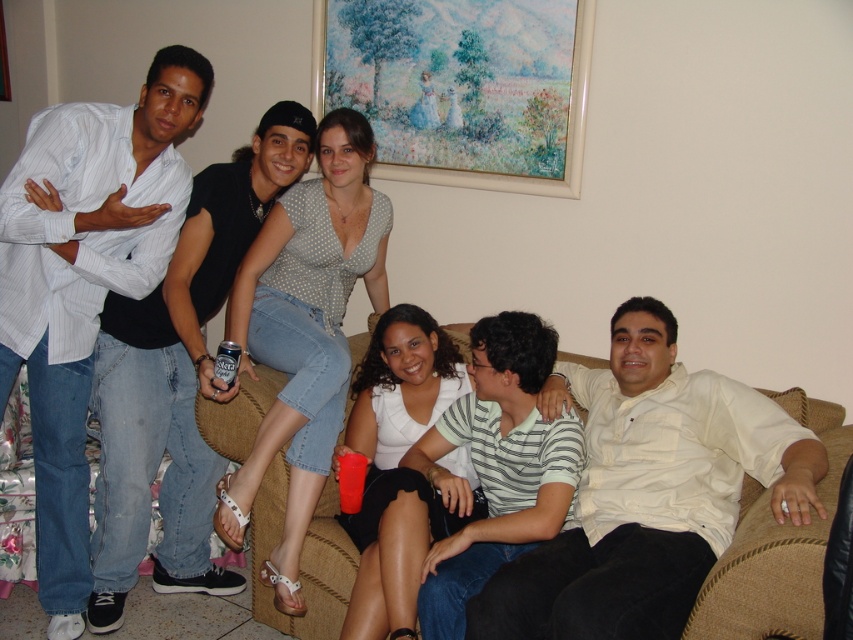
Question: Can you confirm if pastel oil painting at upper center is positioned to the right of polka dot blouse at upper center?

Choices:
 (A) no
 (B) yes

Answer: (B)

Question: Which of the following is the closest to the observer?

Choices:
 (A) white satin shirt at center
 (B) white striped shirt at left

Answer: (A)

Question: Which of these objects is positioned closest to the white satin shirt at center?

Choices:
 (A) white striped shirt at left
 (B) striped cotton polo shirt at center
 (C) pastel oil painting at upper center
 (D) white matte dress at center

Answer: (B)

Question: Does pastel oil painting at upper center have a larger size compared to white matte dress at center?

Choices:
 (A) no
 (B) yes

Answer: (B)

Question: Is pastel oil painting at upper center smaller than polka dot blouse at upper center?

Choices:
 (A) no
 (B) yes

Answer: (B)

Question: Among these points, which one is nearest to the camera?

Choices:
 (A) 340,243
 (B) 746,390
 (C) 144,145
 (D) 564,3

Answer: (B)